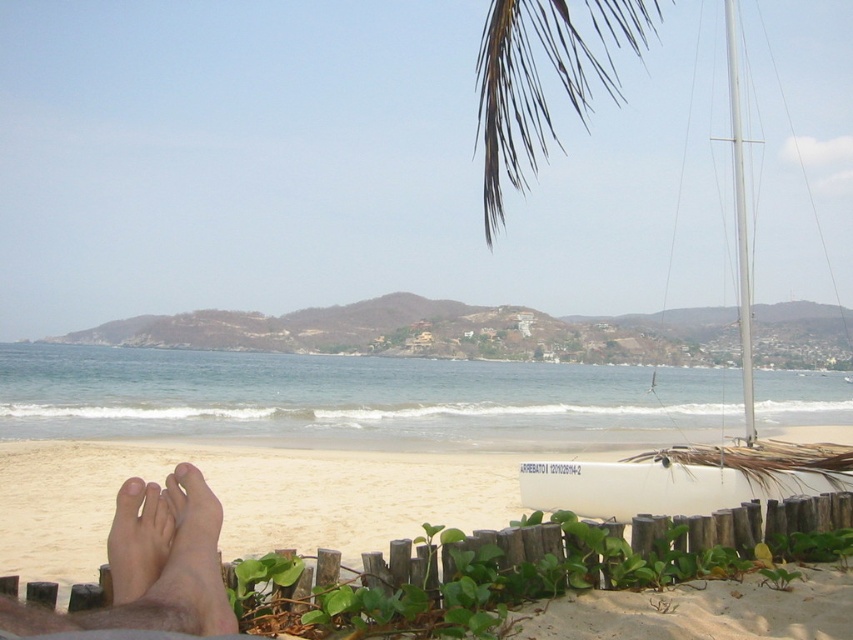
Question: Which object is the farthest from the white matte sailboat at right?

Choices:
 (A) brown/dry palm fronds at upper center
 (B) pale skin foot at lower left
 (C) white sand at lower center

Answer: (B)

Question: Among these points, which one is nearest to the camera?

Choices:
 (A) (200, 518)
 (B) (154, 528)

Answer: (A)

Question: Estimate the real-world distances between objects in this image. Which object is farther from the brown/dry palm fronds at upper center?

Choices:
 (A) pale skin foot at lower left
 (B) pale skin at lower left

Answer: (B)

Question: Is white matte sailboat at right below skinny bare feet at lower left?

Choices:
 (A) no
 (B) yes

Answer: (A)

Question: Does white matte sailboat at right have a smaller size compared to pale skin foot at lower left?

Choices:
 (A) no
 (B) yes

Answer: (A)

Question: Is white matte sailboat at right positioned at the back of skinny bare feet at lower left?

Choices:
 (A) no
 (B) yes

Answer: (B)